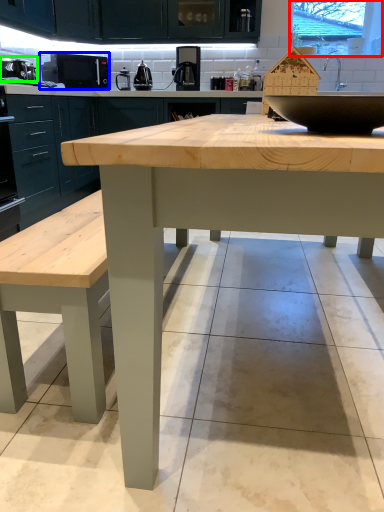
Question: Based on their relative distances, which object is nearer to window screen (highlighted by a red box)? Choose from appliance (highlighted by a blue box) and appliance (highlighted by a green box).

Choices:
 (A) appliance
 (B) appliance

Answer: (A)